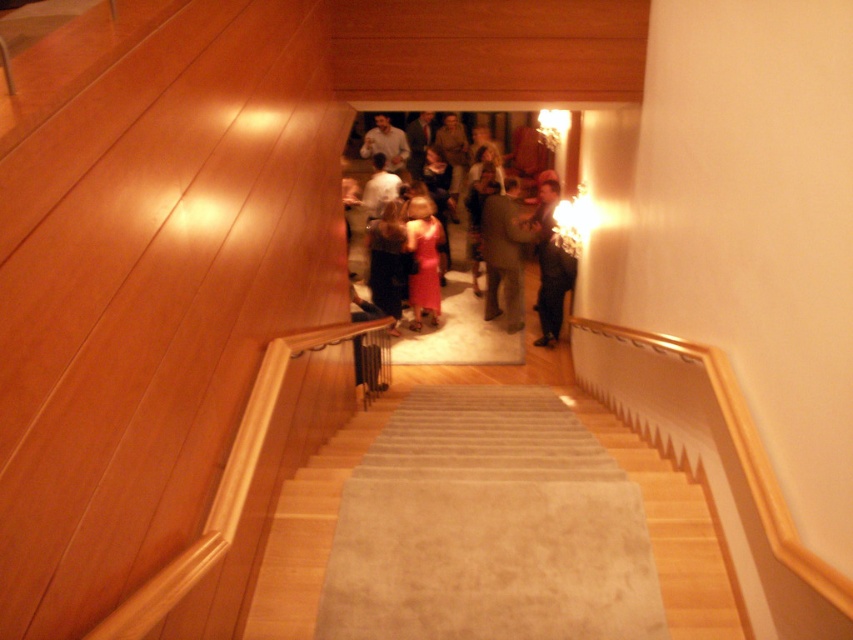
Question: Among these objects, which one is nearest to the camera?

Choices:
 (A) beige carpeted stairs at center
 (B) matte brown suit at center
 (C) matte pink dress at center

Answer: (A)

Question: Among these objects, which one is nearest to the camera?

Choices:
 (A) matte pink dress at center
 (B) beige carpeted stairs at center
 (C) matte brown suit at center

Answer: (B)

Question: Which object is farther from the camera taking this photo?

Choices:
 (A) beige carpeted stairs at center
 (B) matte pink dress at center

Answer: (B)

Question: Is beige carpeted stairs at center to the left of matte brown suit at center from the viewer's perspective?

Choices:
 (A) no
 (B) yes

Answer: (B)

Question: Does matte pink dress at center have a lesser width compared to matte brown suit at center?

Choices:
 (A) no
 (B) yes

Answer: (B)

Question: Does beige carpeted stairs at center have a greater width compared to matte pink dress at center?

Choices:
 (A) no
 (B) yes

Answer: (B)